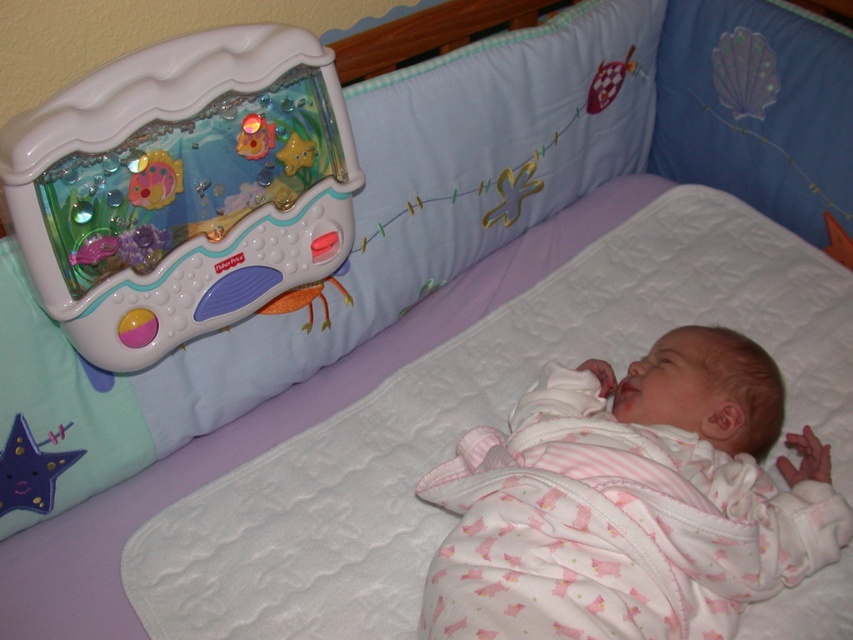
You are holding a camera and want to take a photo of the baby in the crib. The crib has two points marked as point 1 at coordinates point (680, 348) and point 2 at coordinates point (286, 163). Which point is closer to the camera when focusing on the baby?

Point (286, 163) is closer to the camera because it is behind point (680, 348), which is further away from the camera.

Looking at this image, you are a parent checking the crib for safety. The pink cotton baby at center is currently lying in the crib. Is there enough space between the baby and the purple fabric star at lower left to prevent the baby from reaching the star?

The pink cotton baby at center might be wider than purple fabric star at lower left, so there may not be enough space between them to prevent the baby from reaching the star. Ensure the star is placed further away for safety.

You are a parent trying to place a pacifier near the baby in the crib. The pacifier needs to be placed at the point with coordinates point (183, 189). Where should you place the pacifier relative to the crib?

The point (183, 189) corresponds to the plastic toy at upper left, so you should place the pacifier near the plastic toy at upper left.